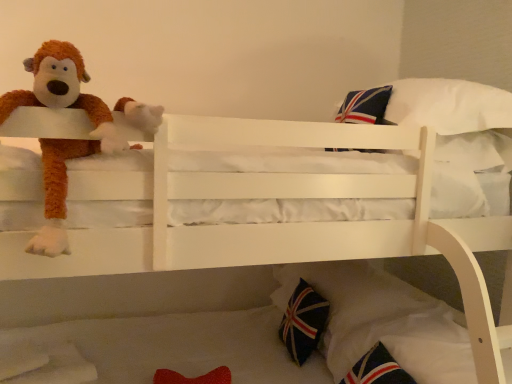
Question: Would you say fluffy brown monkey at left is a long distance from dark blue fabric pillow at lower right?

Choices:
 (A) yes
 (B) no

Answer: (A)

Question: Can you confirm if fluffy brown monkey at left is positioned to the left of dark blue fabric pillow at lower right?

Choices:
 (A) no
 (B) yes

Answer: (B)

Question: Considering the relative sizes of fluffy brown monkey at left and dark blue fabric pillow at lower right in the image provided, is fluffy brown monkey at left taller than dark blue fabric pillow at lower right?

Choices:
 (A) yes
 (B) no

Answer: (A)

Question: Considering the relative sizes of fluffy brown monkey at left and dark blue fabric pillow at lower right in the image provided, is fluffy brown monkey at left wider than dark blue fabric pillow at lower right?

Choices:
 (A) yes
 (B) no

Answer: (A)

Question: From the image's perspective, does fluffy brown monkey at left appear higher than dark blue fabric pillow at lower right?

Choices:
 (A) yes
 (B) no

Answer: (A)

Question: From a real-world perspective, is fluffy brown monkey at left positioned over dark blue fabric pillow at lower right based on gravity?

Choices:
 (A) no
 (B) yes

Answer: (B)

Question: Considering the relative positions of dark blue fabric pillow at lower right and fluffy brown monkey at left in the image provided, is dark blue fabric pillow at lower right to the right of fluffy brown monkey at left from the viewer's perspective?

Choices:
 (A) yes
 (B) no

Answer: (A)

Question: From a real-world perspective, is dark blue fabric pillow at lower right on top of fluffy brown monkey at left?

Choices:
 (A) yes
 (B) no

Answer: (B)

Question: Can you confirm if dark blue fabric pillow at lower right is positioned to the left of fluffy brown monkey at left?

Choices:
 (A) yes
 (B) no

Answer: (B)

Question: Could you tell me if dark blue fabric pillow at lower right is facing fluffy brown monkey at left?

Choices:
 (A) yes
 (B) no

Answer: (B)

Question: Considering the relative sizes of dark blue fabric pillow at lower right and fluffy brown monkey at left in the image provided, is dark blue fabric pillow at lower right shorter than fluffy brown monkey at left?

Choices:
 (A) no
 (B) yes

Answer: (B)

Question: Is dark blue fabric pillow at lower right positioned with its back to fluffy brown monkey at left?

Choices:
 (A) yes
 (B) no

Answer: (B)

Question: Do you think dark blue fabric pillow at lower right is within fluffy brown monkey at left, or outside of it?

Choices:
 (A) inside
 (B) outside

Answer: (B)